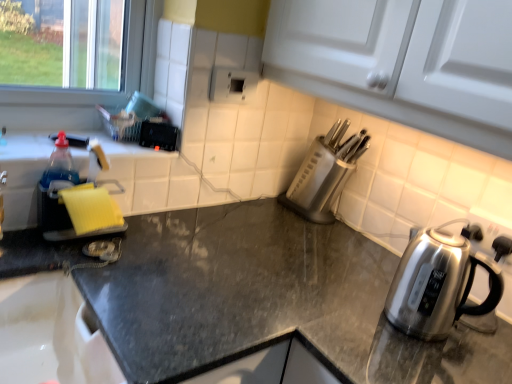
Image resolution: width=512 pixels, height=384 pixels. What are the coordinates of `vacant space in satin silver knife block at center-right (from a real-world perspective)` in the screenshot? It's located at (311, 222).